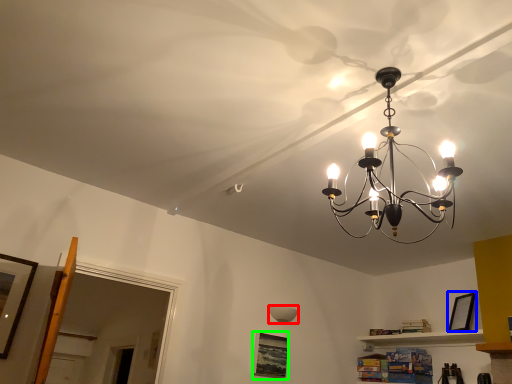
Question: Considering the real-world distances, which object is farthest from lamp (highlighted by a red box)? picture frame (highlighted by a blue box) or picture frame (highlighted by a green box)?

Choices:
 (A) picture frame
 (B) picture frame

Answer: (A)